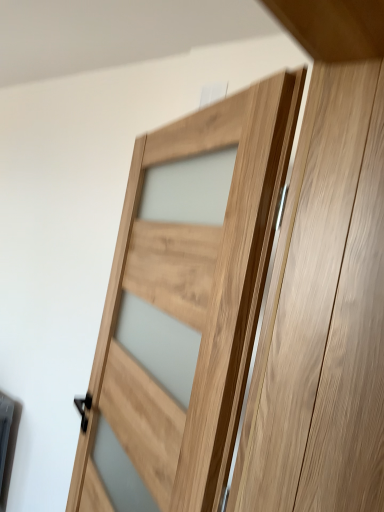
Locate an element on the screen. natural wood door at center is located at coordinates (191, 303).

Describe the element at coordinates (191, 303) in the screenshot. I see `natural wood door at center` at that location.

The image size is (384, 512). In order to click on natural wood door at center in this screenshot , I will do `click(191, 303)`.